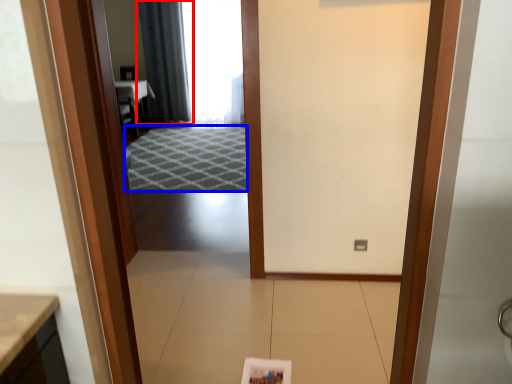
Question: Which of the following is the farthest to the observer, curtain (highlighted by a red box) or doormat (highlighted by a blue box)?

Choices:
 (A) curtain
 (B) doormat

Answer: (A)